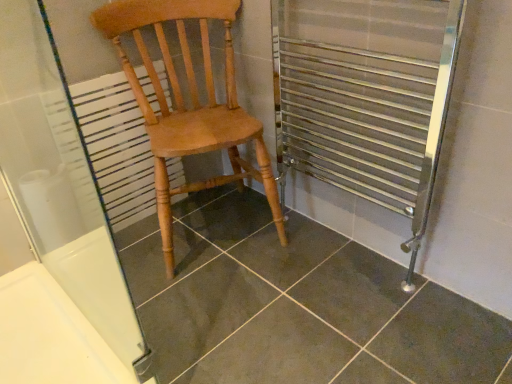
Question: Is transparent glass screen door at upper left to the right of white textured radiator at left from the viewer's perspective?

Choices:
 (A) yes
 (B) no

Answer: (A)

Question: Is transparent glass screen door at upper left taller than white textured radiator at left?

Choices:
 (A) no
 (B) yes

Answer: (B)

Question: Can you confirm if transparent glass screen door at upper left is wider than white textured radiator at left?

Choices:
 (A) yes
 (B) no

Answer: (B)

Question: Is transparent glass screen door at upper left bigger than white textured radiator at left?

Choices:
 (A) yes
 (B) no

Answer: (A)

Question: Is transparent glass screen door at upper left far away from white textured radiator at left?

Choices:
 (A) yes
 (B) no

Answer: (B)

Question: Considering the relative sizes of transparent glass screen door at upper left and white textured radiator at left in the image provided, is transparent glass screen door at upper left shorter than white textured radiator at left?

Choices:
 (A) no
 (B) yes

Answer: (A)

Question: Are transparent glass screen door at upper left and light brown wood chair at center located far from each other?

Choices:
 (A) yes
 (B) no

Answer: (B)

Question: Is transparent glass screen door at upper left in front of light brown wood chair at center?

Choices:
 (A) no
 (B) yes

Answer: (B)

Question: Is transparent glass screen door at upper left at the right side of light brown wood chair at center?

Choices:
 (A) yes
 (B) no

Answer: (B)

Question: Can you confirm if transparent glass screen door at upper left is smaller than light brown wood chair at center?

Choices:
 (A) no
 (B) yes

Answer: (B)

Question: Could light brown wood chair at center be considered to be inside transparent glass screen door at upper left?

Choices:
 (A) no
 (B) yes

Answer: (A)

Question: From the image's perspective, does transparent glass screen door at upper left appear lower than light brown wood chair at center?

Choices:
 (A) yes
 (B) no

Answer: (A)

Question: From the image's perspective, is dark gray tile at center below white textured radiator at left?

Choices:
 (A) no
 (B) yes

Answer: (B)